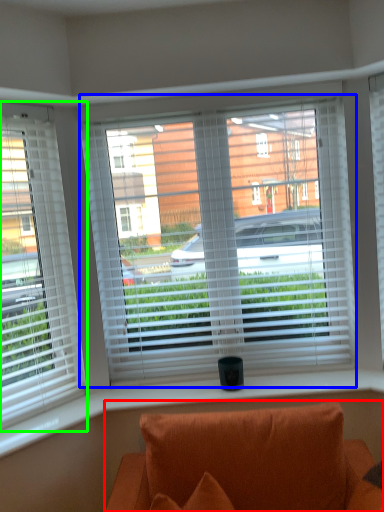
Question: Which is farther away from studio couch (highlighted by a red box)? window (highlighted by a blue box) or window (highlighted by a green box)?

Choices:
 (A) window
 (B) window

Answer: (B)